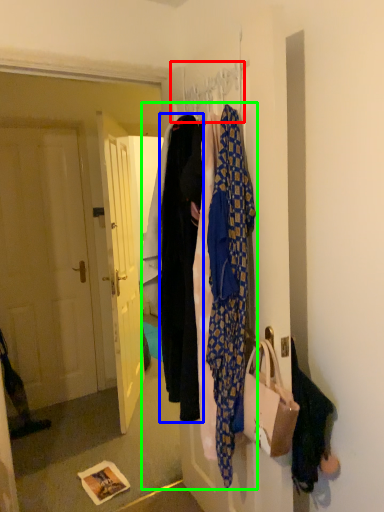
Question: Which object is positioned closest to hanger (highlighted by a red box)? Select from garment (highlighted by a blue box) and closet (highlighted by a green box).

Choices:
 (A) garment
 (B) closet

Answer: (A)